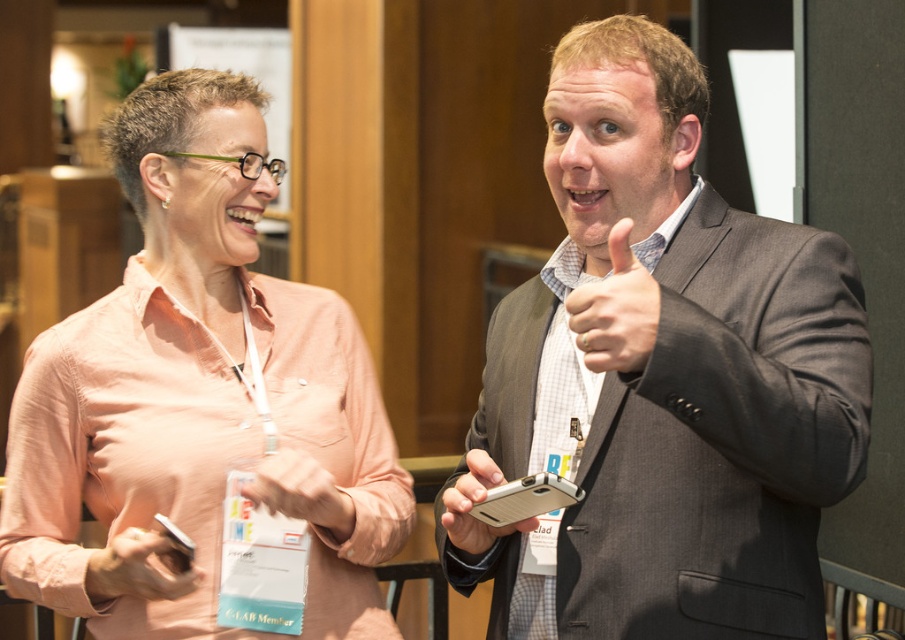
Question: Which point is closer to the camera taking this photo?

Choices:
 (A) (580, 248)
 (B) (175, 516)

Answer: (A)

Question: Which is nearer to the silver matte phone at center?

Choices:
 (A) pink fabric hand at center
 (B) matte black phone at lower left
 (C) gray matte suit at center

Answer: (A)

Question: Which point is closer to the camera taking this photo?

Choices:
 (A) (255, 500)
 (B) (639, 282)
 (C) (584, 337)
 (D) (167, 579)

Answer: (C)

Question: Is the position of matte pink shirt at upper left more distant than that of silver matte phone at center?

Choices:
 (A) yes
 (B) no

Answer: (A)

Question: Observing the image, what is the correct spatial positioning of matte gray hand at center in reference to pink fabric hand at center?

Choices:
 (A) below
 (B) above

Answer: (B)

Question: Can you confirm if matte gray hand at center is thinner than matte black phone at lower left?

Choices:
 (A) yes
 (B) no

Answer: (A)